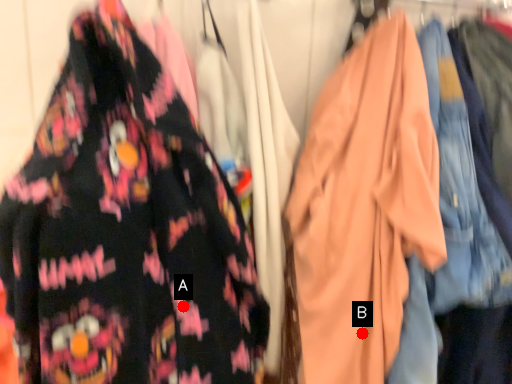
Question: Two points are circled on the image, labeled by A and B beside each circle. Which point appears closest to the camera in this image?

Choices:
 (A) A is closer
 (B) B is closer

Answer: (A)